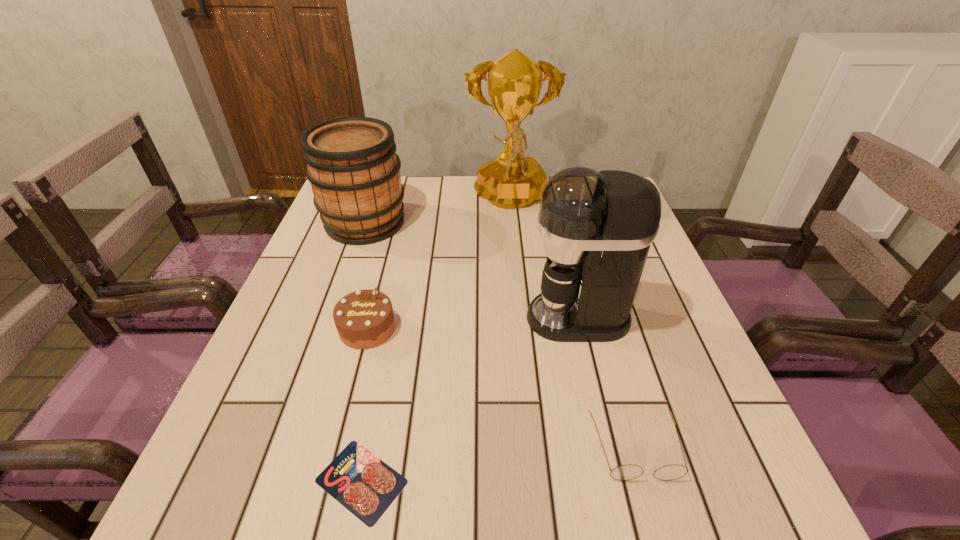
The height and width of the screenshot is (540, 960). What are the coordinates of `vacant area located 0.110m on the front of the third tallest object` in the screenshot? It's located at (347, 276).

At what (x,y) coordinates should I click in order to perform the action: click on vacant space situated on the back of the fourth tallest object. Please return your answer as a coordinate pair (x, y). Looking at the image, I should click on (393, 231).

The width and height of the screenshot is (960, 540). In order to click on free space located on the back of the shortest object in this screenshot , I will do `click(392, 332)`.

At what (x,y) coordinates should I click in order to perform the action: click on award located in the far edge section of the desktop. Please return your answer as a coordinate pair (x, y). The height and width of the screenshot is (540, 960). Looking at the image, I should click on (511, 181).

This screenshot has width=960, height=540. Identify the location of cider that is positioned at the far edge. (352, 166).

Locate an element on the screen. This screenshot has width=960, height=540. spectacles that is at the near edge is located at coordinates (624, 472).

Where is `salami that is at the near edge`? Image resolution: width=960 pixels, height=540 pixels. salami that is at the near edge is located at coordinates (366, 486).

This screenshot has height=540, width=960. In order to click on cider that is at the left edge in this screenshot , I will do `click(352, 166)`.

Find the location of `chocolate cake present at the left edge`. chocolate cake present at the left edge is located at coordinates (364, 319).

At what (x,y) coordinates should I click in order to perform the action: click on coffee maker that is at the right edge. Please return your answer as a coordinate pair (x, y). This screenshot has height=540, width=960. Looking at the image, I should click on point(597,227).